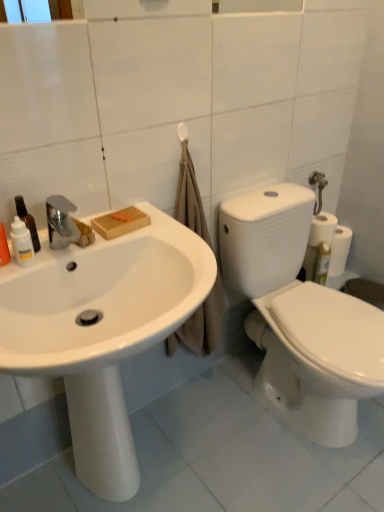
Question: From the image's perspective, relative to white glossy bottle at left, is translucent plastic spray bottle at left, which appears as the second cleaning product when viewed from the right, above or below?

Choices:
 (A) below
 (B) above

Answer: (B)

Question: From a real-world perspective, is translucent plastic spray bottle at left, which appears as the second cleaning product when viewed from the right, above or below white glossy bottle at left?

Choices:
 (A) above
 (B) below

Answer: (A)

Question: Which of these objects is positioned farthest from the white glossy sink at left?

Choices:
 (A) white glossy bottle at left
 (B) white matte toilet paper at right
 (C) white matte towel bar at upper center
 (D) translucent plastic spray bottle at left, which appears as the second cleaning product when viewed from the right
 (E) translucent plastic bottle at left, which ranks as the second cleaning product in left-to-right order

Answer: (B)

Question: Based on their relative distances, which object is nearer to the white matte towel bar at upper center?

Choices:
 (A) white matte toilet paper at right
 (B) translucent plastic spray bottle at left, which is counted as the 1th cleaning product, starting from the left
 (C) translucent plastic bottle at left, positioned as the first cleaning product in right-to-left order
 (D) white glossy bottle at left
 (E) white glossy sink at left

Answer: (C)